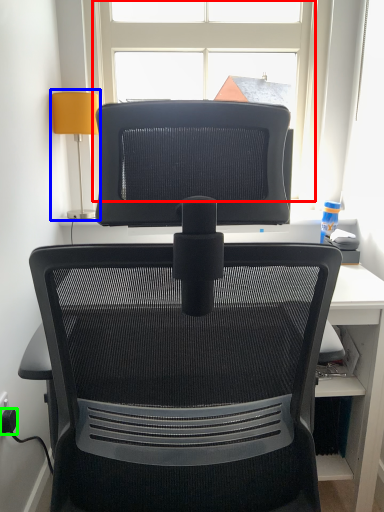
Question: Based on their relative distances, which object is farther from window (highlighted by a red box)? Choose from table lamp (highlighted by a blue box) and plug (highlighted by a green box).

Choices:
 (A) table lamp
 (B) plug

Answer: (B)